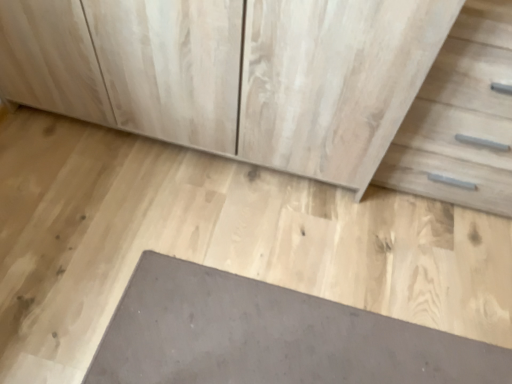
Question: Considering their positions, is light wood cabinet at center located in front of or behind gray concrete at center?

Choices:
 (A) front
 (B) behind

Answer: (A)

Question: Is light wood cabinet at center taller or shorter than gray concrete at center?

Choices:
 (A) short
 (B) tall

Answer: (B)

Question: Based on their relative distances, which object is nearer to the light wood cabinet at center?

Choices:
 (A) light wood drawer at right
 (B) gray concrete at center
 (C) slate at lower center

Answer: (B)

Question: Considering the real-world distances, which object is closest to the gray concrete at center?

Choices:
 (A) light wood drawer at right
 (B) light wood cabinet at center
 (C) slate at lower center

Answer: (C)